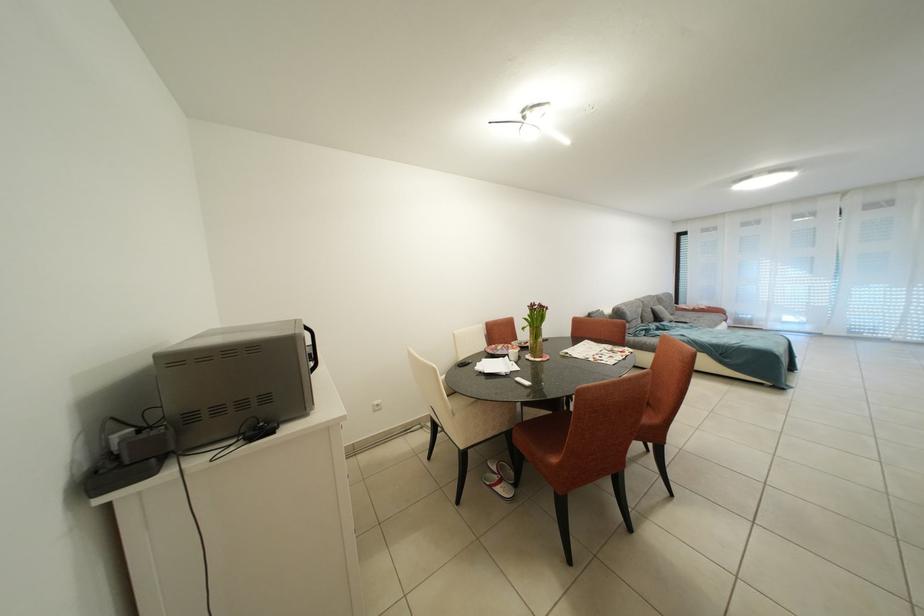
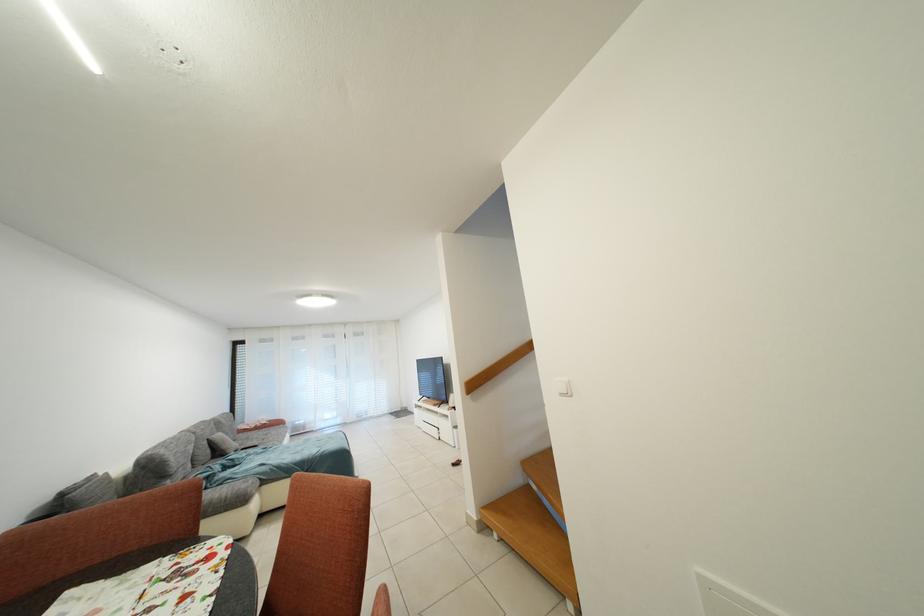
Where in the second image is the point corresponding to pixel 665 323 from the first image?

(226, 456)